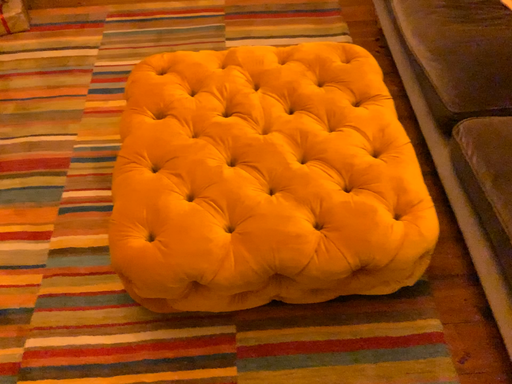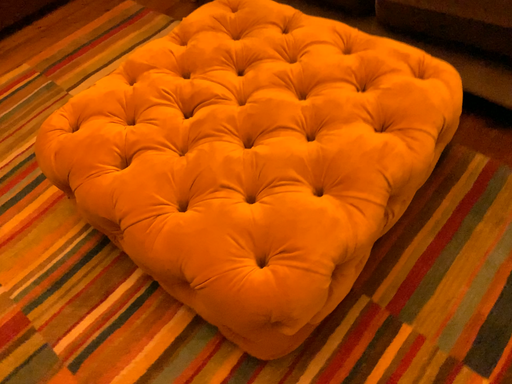
Question: Which way did the camera rotate in the video?

Choices:
 (A) rotated left
 (B) rotated right

Answer: (B)